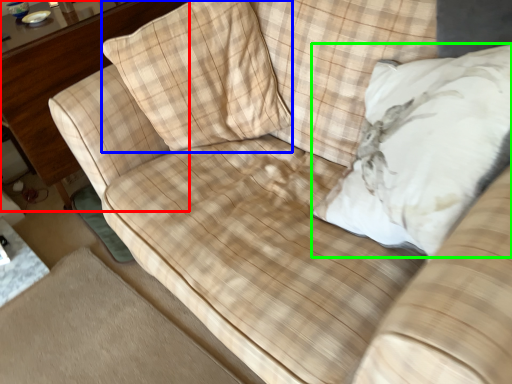
Question: Which is farther away from dresser (highlighted by a red box)? throw pillow (highlighted by a blue box) or throw pillow (highlighted by a green box)?

Choices:
 (A) throw pillow
 (B) throw pillow

Answer: (B)